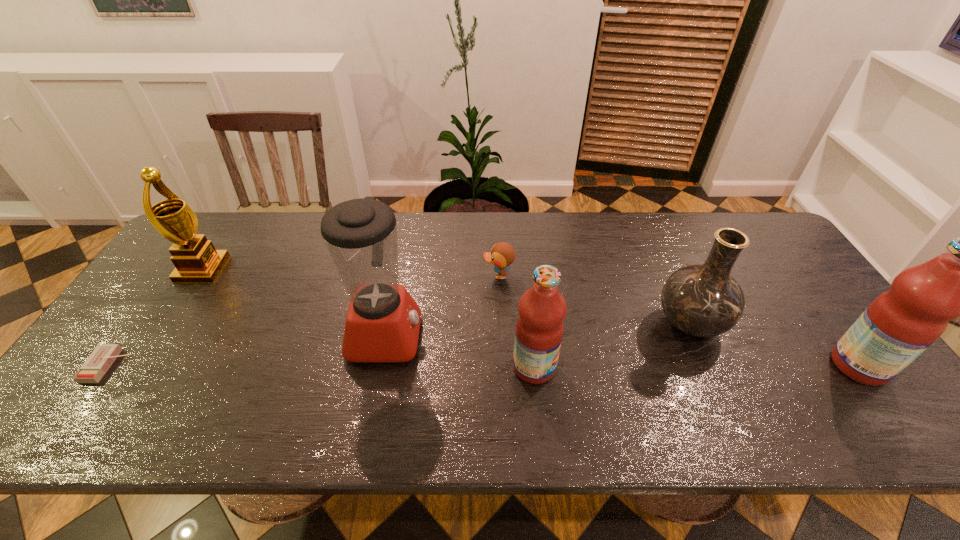
Find the location of a particular element. This screenshot has width=960, height=540. vacant point located 0.160m on the front-facing side of the duck is located at coordinates (428, 276).

The width and height of the screenshot is (960, 540). Identify the location of vacant space situated on the front-facing side of the duck. (452, 276).

At what (x,y) coordinates should I click in order to perform the action: click on vacant space located 0.240m on the front-facing side of the award. Please return your answer as a coordinate pair (x, y). Looking at the image, I should click on (303, 269).

Identify the location of free space located 0.310m on the left of the sixth object from left to right. point(537,324).

This screenshot has height=540, width=960. I want to click on free space located on the front of the fifth object from right to left near the controls, so click(507, 336).

Where is `free space located 0.310m on the striking surface of the shortest object`? free space located 0.310m on the striking surface of the shortest object is located at coordinates (252, 366).

You are a GUI agent. You are given a task and a screenshot of the screen. Output one action in this format:
    pyautogui.click(x=<x>, y=<y>)
    Task: Click on the object that is positioned at the far edge
    The height and width of the screenshot is (540, 960).
    Given the screenshot: What is the action you would take?
    pyautogui.click(x=196, y=260)

Where is `blender located at the near edge`? The image size is (960, 540). blender located at the near edge is located at coordinates (382, 325).

At what (x,y) coordinates should I click in order to perform the action: click on matchbox located at the near edge. Please return your answer as a coordinate pair (x, y). The width and height of the screenshot is (960, 540). Looking at the image, I should click on (99, 361).

Where is `award located at the left edge`? The image size is (960, 540). award located at the left edge is located at coordinates (196, 260).